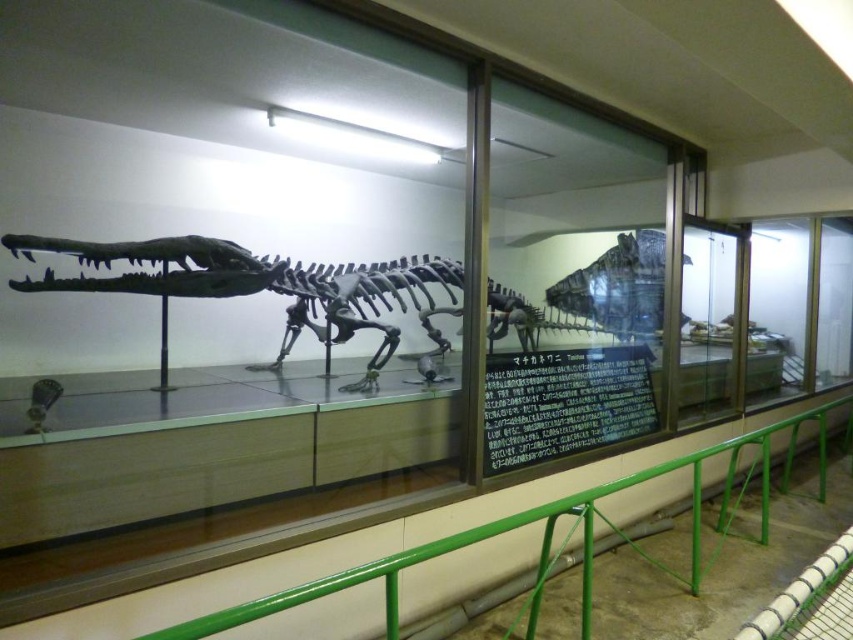
Does black matte signboard at center appear on the left side of green metal railing at lower center?

No, black matte signboard at center is not to the left of green metal railing at lower center.

Which is behind, point (512, 436) or point (544, 563)?

Positioned behind is point (512, 436).

I want to click on black matte signboard at center, so click(564, 403).

What do you see at coordinates (564, 403) in the screenshot? I see `black matte signboard at center` at bounding box center [564, 403].

Is black matte signboard at center shorter than shiny metallic dinosaur skeleton at center?

Yes.

Which is behind, point (514, 358) or point (654, 300)?

Positioned behind is point (654, 300).

This screenshot has width=853, height=640. In order to click on black matte signboard at center in this screenshot , I will do `click(564, 403)`.

Between green metal railing at lower center and shiny metallic dinosaur skeleton at center, which one appears on the right side from the viewer's perspective?

Positioned to the right is shiny metallic dinosaur skeleton at center.

Is green metal railing at lower center above shiny metallic dinosaur skeleton at center?

Actually, green metal railing at lower center is below shiny metallic dinosaur skeleton at center.

Find the location of `green metal railing at lower center`. green metal railing at lower center is located at coordinates (506, 531).